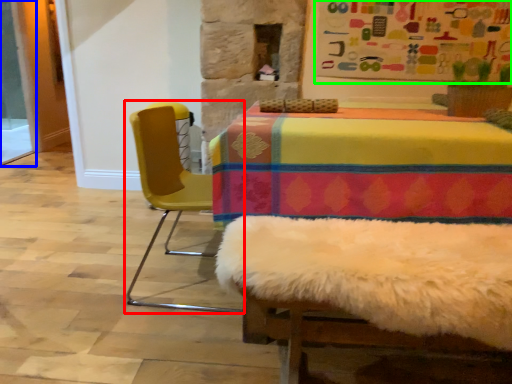
Question: Based on their relative distances, which object is farther from chair (highlighted by a red box)? Choose from screen door (highlighted by a blue box) and bulletin board (highlighted by a green box).

Choices:
 (A) screen door
 (B) bulletin board

Answer: (A)